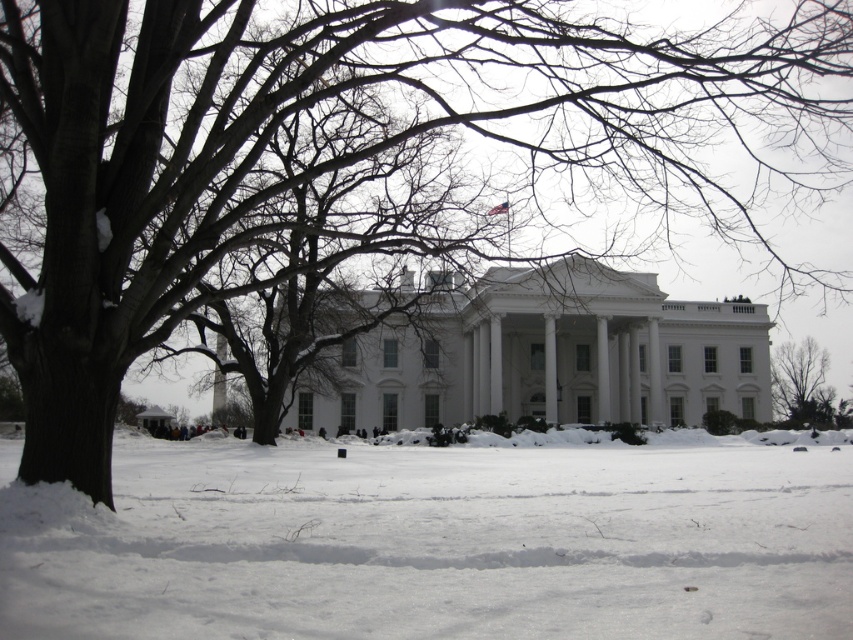
Question: Is white fluffy snow at center to the right of bare branches at lower right from the viewer's perspective?

Choices:
 (A) no
 (B) yes

Answer: (A)

Question: Which of the following is the farthest from the observer?

Choices:
 (A) white fluffy snow at center
 (B) bare branches at lower right

Answer: (B)

Question: Does white fluffy snow at center appear on the right side of bare branches at lower right?

Choices:
 (A) yes
 (B) no

Answer: (B)

Question: Which of the following is the closest to the observer?

Choices:
 (A) (590, 513)
 (B) (776, 413)

Answer: (A)

Question: Is white fluffy snow at center below bare branches at lower right?

Choices:
 (A) yes
 (B) no

Answer: (B)